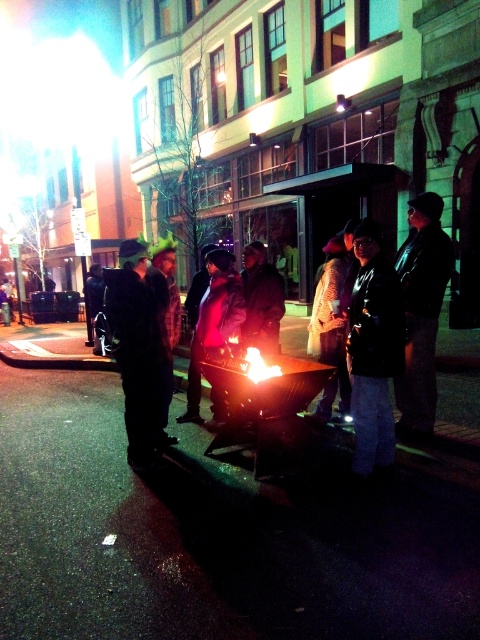
Question: Can you confirm if black matte jacket at center is positioned to the right of dark brown leather jacket at center?

Choices:
 (A) no
 (B) yes

Answer: (A)

Question: Among these points, which one is farthest from the camera?

Choices:
 (A) (146, 444)
 (B) (364, 360)

Answer: (A)

Question: Can you confirm if black leather jacket at center is positioned below dark brown leather jacket at center?

Choices:
 (A) no
 (B) yes

Answer: (B)

Question: Which point is closer to the camera taking this photo?

Choices:
 (A) (379, 323)
 (B) (245, 308)
 (C) (123, 250)
 (D) (175, 253)

Answer: (A)

Question: Is dark gray hoodie at center to the right of dark brown leather jacket at center from the viewer's perspective?

Choices:
 (A) yes
 (B) no

Answer: (A)

Question: Among these objects, which one is nearest to the camera?

Choices:
 (A) black matte jacket at center
 (B) black leather jacket at center
 (C) dark gray hoodie at center
 (D) dark brown leather jacket at center

Answer: (C)